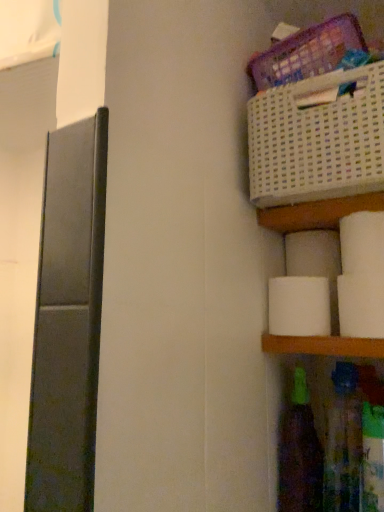
Question: Would you say white matte toilet paper at right, which is the 3th toilet paper from back to front, is a long distance from white matte toilet paper at right, marked as the 3th toilet paper in a front-to-back arrangement?

Choices:
 (A) no
 (B) yes

Answer: (A)

Question: Can you confirm if white matte toilet paper at right, which is the 3th toilet paper from back to front, is thinner than white matte toilet paper at right, marked as the 3th toilet paper in a front-to-back arrangement?

Choices:
 (A) no
 (B) yes

Answer: (B)

Question: Considering the relative sizes of white matte toilet paper at right, which is counted as the 2th toilet paper, starting from the front, and white matte toilet paper at right, marked as the 3th toilet paper in a front-to-back arrangement, in the image provided, is white matte toilet paper at right, which is counted as the 2th toilet paper, starting from the front, shorter than white matte toilet paper at right, marked as the 3th toilet paper in a front-to-back arrangement,?

Choices:
 (A) yes
 (B) no

Answer: (A)

Question: From the image's perspective, does white matte toilet paper at right, which is counted as the 2th toilet paper, starting from the front, appear lower than white matte toilet paper at right, which is counted as the second toilet paper, starting from the back?

Choices:
 (A) no
 (B) yes

Answer: (A)

Question: Can you confirm if white matte toilet paper at right, which is counted as the 2th toilet paper, starting from the front, is smaller than white matte toilet paper at right, marked as the 3th toilet paper in a front-to-back arrangement?

Choices:
 (A) yes
 (B) no

Answer: (A)

Question: Can you confirm if white matte toilet paper at right, which is counted as the 2th toilet paper, starting from the front, is wider than white matte toilet paper at right, which is counted as the second toilet paper, starting from the back?

Choices:
 (A) yes
 (B) no

Answer: (B)

Question: Is translucent plastic bottle at lower right, which appears as the 2th bottle when viewed from the left, oriented away from white matte toilet paper at right, the 4th toilet paper from the front?

Choices:
 (A) no
 (B) yes

Answer: (A)

Question: Could you tell me if translucent plastic bottle at lower right, which appears as the 2th bottle when viewed from the left, is turned towards white matte toilet paper at right, which ranks as the first toilet paper in back-to-front order?

Choices:
 (A) yes
 (B) no

Answer: (B)

Question: From the image's perspective, is translucent plastic bottle at lower right, the first bottle from the right, beneath white matte toilet paper at right, which ranks as the first toilet paper in back-to-front order?

Choices:
 (A) yes
 (B) no

Answer: (A)

Question: From a real-world perspective, is translucent plastic bottle at lower right, the first bottle from the right, below white matte toilet paper at right, which ranks as the first toilet paper in back-to-front order?

Choices:
 (A) yes
 (B) no

Answer: (A)

Question: From the image's perspective, is translucent plastic bottle at lower right, which appears as the 2th bottle when viewed from the left, on white matte toilet paper at right, the 4th toilet paper from the front?

Choices:
 (A) no
 (B) yes

Answer: (A)

Question: Is translucent plastic bottle at lower right, which appears as the 2th bottle when viewed from the left, wider than white matte toilet paper at right, the 4th toilet paper from the front?

Choices:
 (A) no
 (B) yes

Answer: (B)

Question: Does white matte toilet paper at lower right, the fourth toilet paper positioned from the back, have a greater width compared to white matte toilet paper at right, which is the 3th toilet paper from back to front?

Choices:
 (A) no
 (B) yes

Answer: (A)